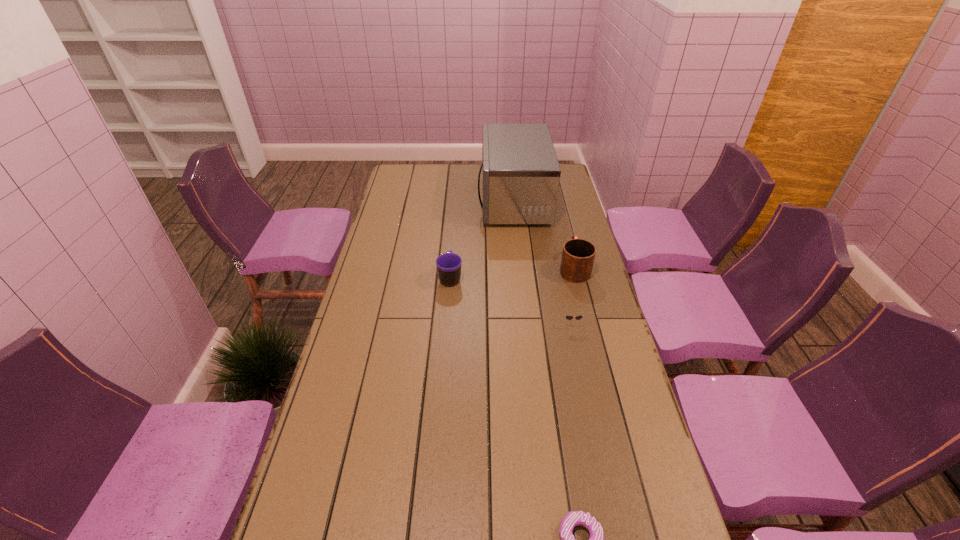
At what (x,y) coordinates should I click in order to perform the action: click on microwave oven. Please return your answer as a coordinate pair (x, y). The image size is (960, 540). Looking at the image, I should click on (521, 174).

This screenshot has width=960, height=540. I want to click on the tallest object, so click(521, 174).

Locate an element on the screen. the right mug is located at coordinates point(578,255).

You are a GUI agent. You are given a task and a screenshot of the screen. Output one action in this format:
    pyautogui.click(x=<x>, y=<y>)
    Task: Click on the second tallest object
    The image size is (960, 540).
    Given the screenshot: What is the action you would take?
    pyautogui.click(x=578, y=255)

The width and height of the screenshot is (960, 540). Find the location of `the left mug`. the left mug is located at coordinates (448, 265).

The width and height of the screenshot is (960, 540). Find the location of `the third tallest object`. the third tallest object is located at coordinates pos(448,265).

At what (x,y) coordinates should I click in order to perform the action: click on the second shortest object. Please return your answer as a coordinate pair (x, y). The height and width of the screenshot is (540, 960). Looking at the image, I should click on (568, 317).

At what (x,y) coordinates should I click in order to perform the action: click on the fourth farthest object. Please return your answer as a coordinate pair (x, y). The width and height of the screenshot is (960, 540). Looking at the image, I should click on (568, 317).

At what (x,y) coordinates should I click in order to perform the action: click on free space located on the front-facing side of the farthest object. Please return your answer as a coordinate pair (x, y). This screenshot has width=960, height=540. Looking at the image, I should click on (454, 200).

Where is `free space located on the front-facing side of the farthest object`? This screenshot has width=960, height=540. free space located on the front-facing side of the farthest object is located at coordinates (410, 200).